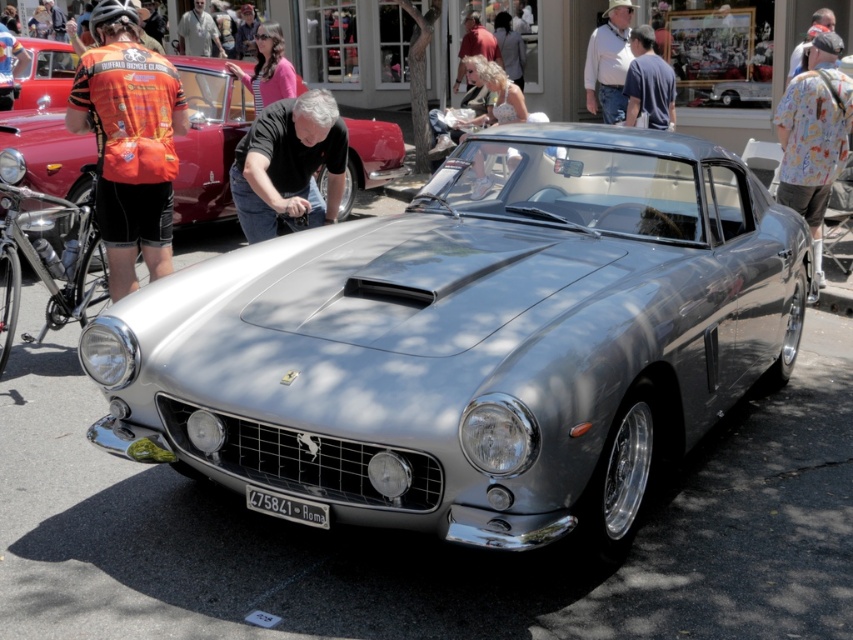
Does black metal/texture license plate at center have a greater width compared to gray fabric shirt at center?

No, black metal/texture license plate at center is not wider than gray fabric shirt at center.

Does black metal/texture license plate at center appear on the left side of gray fabric shirt at center?

Incorrect, black metal/texture license plate at center is not on the left side of gray fabric shirt at center.

What do you see at coordinates (287, 506) in the screenshot? I see `black metal/texture license plate at center` at bounding box center [287, 506].

Where is `black metal/texture license plate at center`? black metal/texture license plate at center is located at coordinates point(287,506).

Who is higher up, gray fabric shirt at center or orange cycling jersey at upper left?

gray fabric shirt at center is above.

This screenshot has width=853, height=640. Find the location of `gray fabric shirt at center`. gray fabric shirt at center is located at coordinates (198, 33).

You are a GUI agent. You are given a task and a screenshot of the screen. Output one action in this format:
    pyautogui.click(x=<x>, y=<y>)
    Task: Click on the gray fabric shirt at center
    
    Given the screenshot: What is the action you would take?
    pyautogui.click(x=198, y=33)

Between orange jersey at left and orange cycling jersey at upper left, which one is positioned higher?

orange cycling jersey at upper left is higher up.

Does orange jersey at left have a lesser height compared to orange cycling jersey at upper left?

No, orange jersey at left is not shorter than orange cycling jersey at upper left.

Image resolution: width=853 pixels, height=640 pixels. What do you see at coordinates (129, 141) in the screenshot?
I see `orange jersey at left` at bounding box center [129, 141].

Find the location of a particular element. This screenshot has height=640, width=853. orange jersey at left is located at coordinates (x=129, y=141).